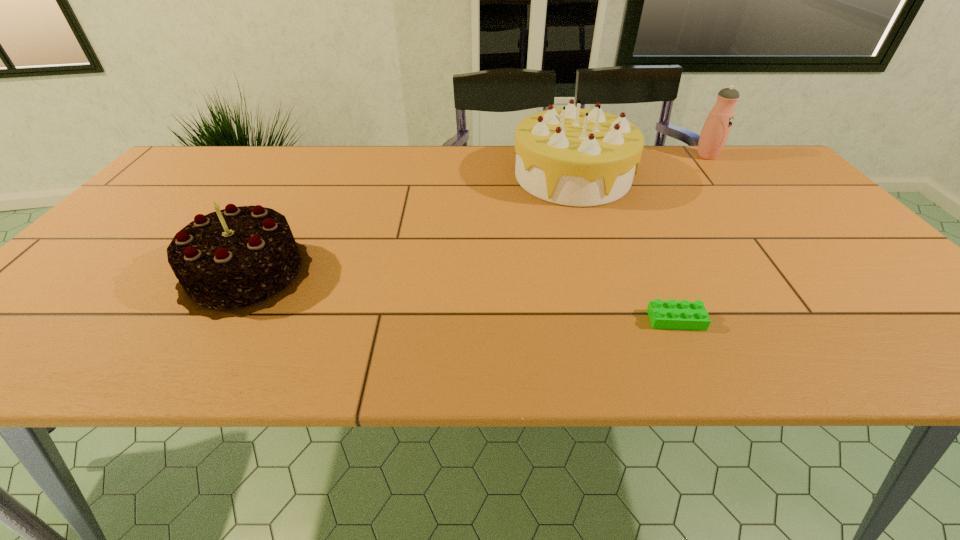
The width and height of the screenshot is (960, 540). What are the coordinates of `thermos bottle` in the screenshot? It's located at (716, 129).

Where is `the right birthday cake`? The image size is (960, 540). the right birthday cake is located at coordinates (569, 156).

In order to click on the left birthday cake in this screenshot , I will do `click(233, 262)`.

What are the coordinates of `the leftmost object` in the screenshot? It's located at (233, 262).

Find the location of a particular element. This screenshot has width=960, height=540. Lego is located at coordinates (681, 315).

Locate an element on the screen. This screenshot has width=960, height=540. free point located on the front of the rightmost object is located at coordinates (762, 225).

You are a GUI agent. You are given a task and a screenshot of the screen. Output one action in this format:
    pyautogui.click(x=<x>, y=<y>)
    Task: Click on the free region located on the front of the farther birthday cake
    Image resolution: width=960 pixels, height=540 pixels.
    Given the screenshot: What is the action you would take?
    pyautogui.click(x=597, y=255)

Image resolution: width=960 pixels, height=540 pixels. I want to click on free space located on the left of the leftmost object, so click(91, 273).

The height and width of the screenshot is (540, 960). I want to click on free space located on the right of the Lego, so click(897, 320).

You are a GUI agent. You are given a task and a screenshot of the screen. Output one action in this format:
    pyautogui.click(x=<x>, y=<y>)
    Task: Click on the thermos bottle that is at the far edge
    The image size is (960, 540).
    Given the screenshot: What is the action you would take?
    pyautogui.click(x=716, y=129)